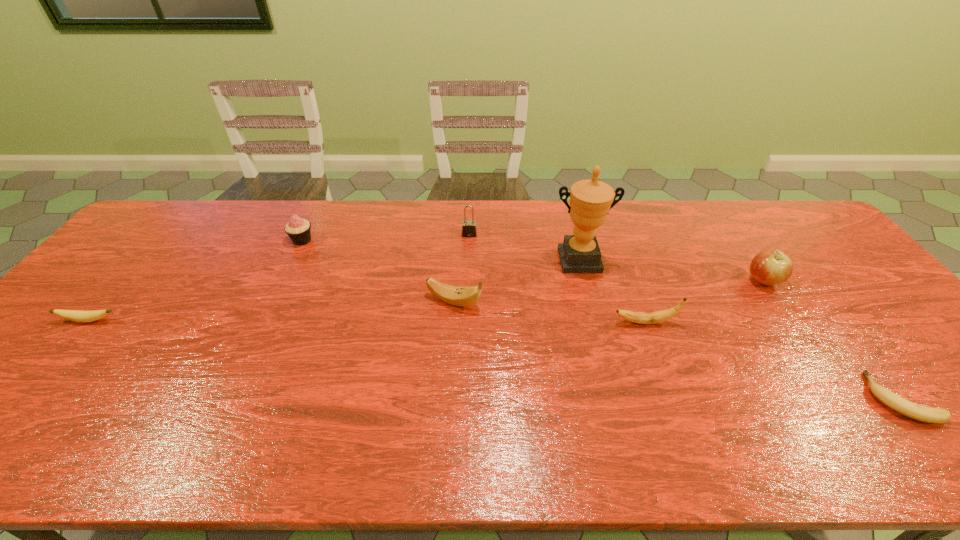
At what (x,y) coordinates should I click in order to perform the action: click on vacant area between the padlock and the shortest object. Please return your answer as a coordinate pair (x, y). This screenshot has height=540, width=960. Looking at the image, I should click on (685, 316).

Image resolution: width=960 pixels, height=540 pixels. In order to click on vacant space that is in between the farthest banana and the padlock in this screenshot , I will do `click(462, 268)`.

At what (x,y) coordinates should I click in order to perform the action: click on vacant space in between the leftmost object and the third banana from left to right. Please return your answer as a coordinate pair (x, y). This screenshot has width=960, height=540. Looking at the image, I should click on (367, 321).

This screenshot has width=960, height=540. I want to click on vacant area between the seventh tallest object and the cupcake, so click(196, 280).

Locate an element on the screen. The width and height of the screenshot is (960, 540). empty space that is in between the award and the padlock is located at coordinates (524, 247).

Find the location of a particular element. Image resolution: width=960 pixels, height=540 pixels. vacant area that lies between the padlock and the tallest object is located at coordinates (524, 247).

The height and width of the screenshot is (540, 960). I want to click on free space between the farthest banana and the award, so click(x=516, y=281).

At what (x,y) coordinates should I click in order to perform the action: click on free space between the nearest banana and the tallest object. Please return your answer as a coordinate pair (x, y). Looking at the image, I should click on pyautogui.click(x=740, y=329).

Where is `free space between the padlock and the second object from left to right`? free space between the padlock and the second object from left to right is located at coordinates (386, 238).

This screenshot has height=540, width=960. In order to click on free point between the second banana from right to left and the award in this screenshot , I will do `click(612, 291)`.